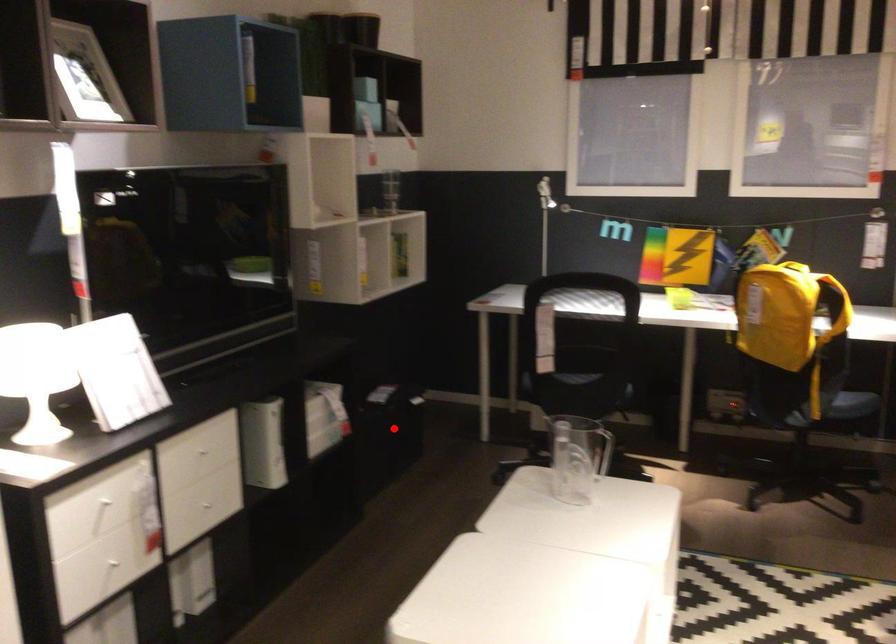
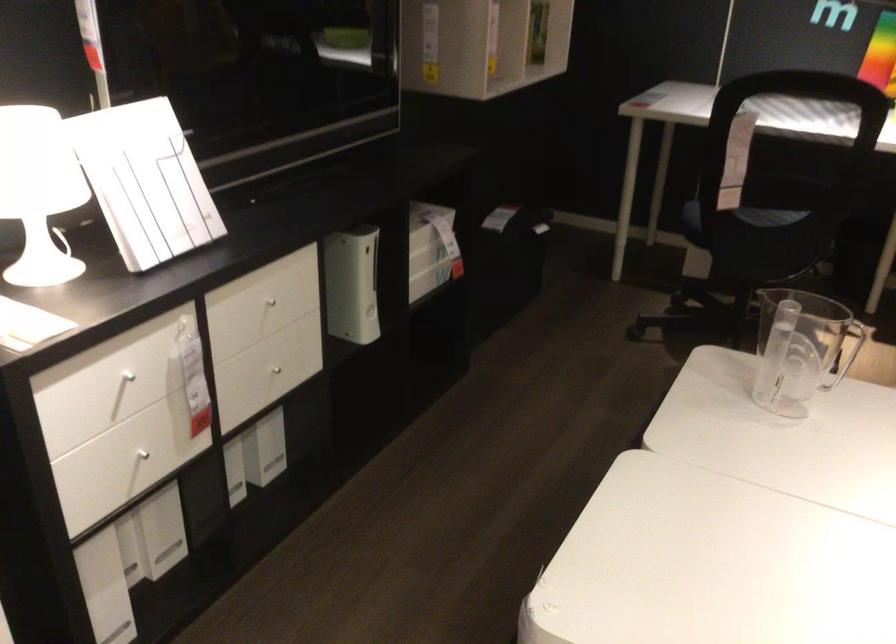
Question: I am providing you with two images of the same scene from different viewpoints. Given a red point in image1, look at the same physical point in image2. Is it:

Choices:
 (A) Closer to the viewpoint
 (B) Farther from the viewpoint

Answer: (A)